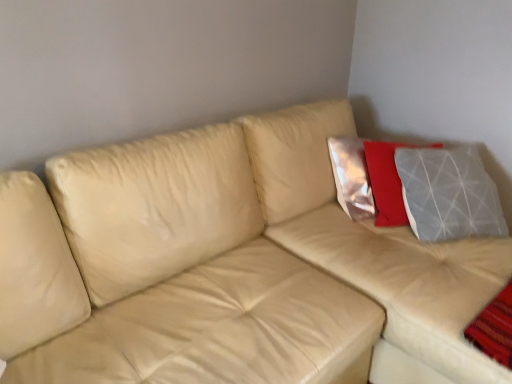
Locate an element on the screen. beige leather couch at center is located at coordinates (234, 265).

What do you see at coordinates (234, 265) in the screenshot? I see `beige leather couch at center` at bounding box center [234, 265].

Locate an element on the screen. beige leather couch at center is located at coordinates (234, 265).